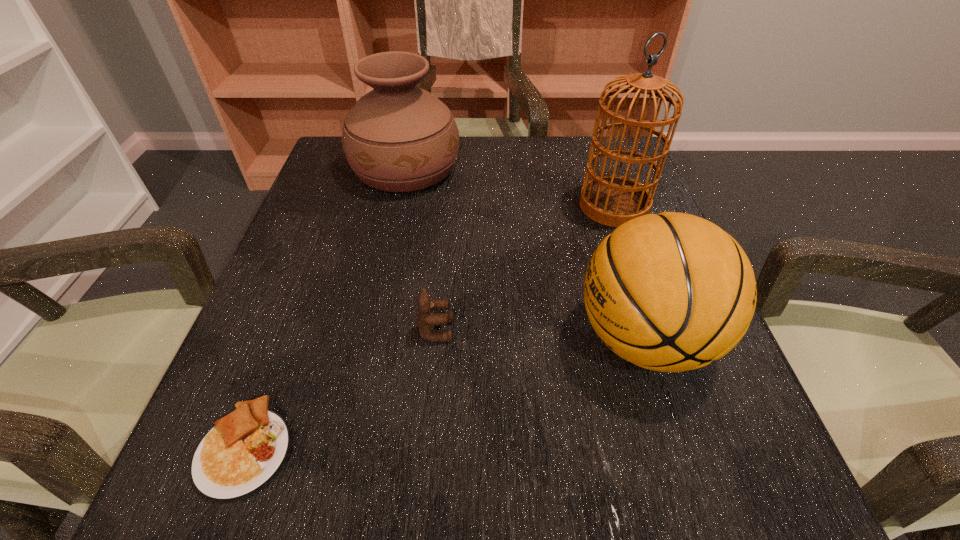
Find the location of a particular element. This screenshot has width=960, height=540. vacant area that lies between the basketball and the teddy bear is located at coordinates (540, 334).

You are a GUI agent. You are given a task and a screenshot of the screen. Output one action in this format:
    pyautogui.click(x=<x>, y=<y>)
    Task: Click on the vacant area between the fourth tallest object and the basketball
    Image resolution: width=960 pixels, height=540 pixels.
    Given the screenshot: What is the action you would take?
    pyautogui.click(x=540, y=334)

Identify the location of vacant region between the urn and the birdcage. This screenshot has height=540, width=960. (510, 187).

Locate an element on the screen. The width and height of the screenshot is (960, 540). unoccupied area between the urn and the teddy bear is located at coordinates (420, 249).

Where is `free space between the teddy bear and the birdcage`? The height and width of the screenshot is (540, 960). free space between the teddy bear and the birdcage is located at coordinates (525, 268).

This screenshot has width=960, height=540. I want to click on free space that is in between the shortest object and the basketball, so click(x=444, y=393).

The height and width of the screenshot is (540, 960). What are the coordinates of `free space between the teddy bear and the birdcage` in the screenshot? It's located at (525, 268).

You are a GUI agent. You are given a task and a screenshot of the screen. Output one action in this format:
    pyautogui.click(x=<x>, y=<y>)
    Task: Click on the empty space that is in between the urn and the teddy bear
    The image size is (960, 540).
    Given the screenshot: What is the action you would take?
    pyautogui.click(x=420, y=249)

What are the coordinates of `the third closest object to the urn` in the screenshot? It's located at (671, 292).

The height and width of the screenshot is (540, 960). What are the coordinates of `object that ranks as the fourth closest to the urn` in the screenshot? It's located at (238, 457).